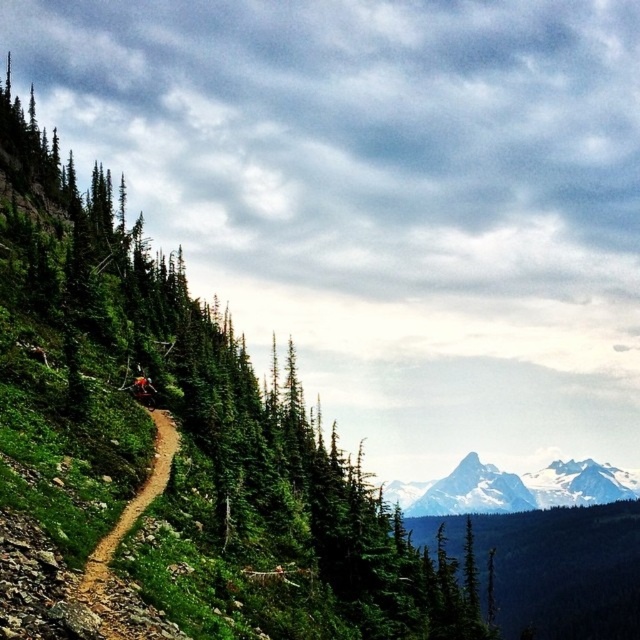
Question: Which point appears closest to the camera in this image?

Choices:
 (A) (515, 480)
 (B) (420, 586)

Answer: (B)

Question: Does green leafy tree at center-left have a larger size compared to white snow-covered mountain at center?

Choices:
 (A) yes
 (B) no

Answer: (A)

Question: Is green leafy tree at center-left behind white snow-covered mountain at center?

Choices:
 (A) no
 (B) yes

Answer: (A)

Question: Is green leafy tree at center-left bigger than white snow-covered mountain at center?

Choices:
 (A) yes
 (B) no

Answer: (A)

Question: Among these objects, which one is nearest to the camera?

Choices:
 (A) white snow-covered mountain at center
 (B) green leafy tree at center-left

Answer: (B)